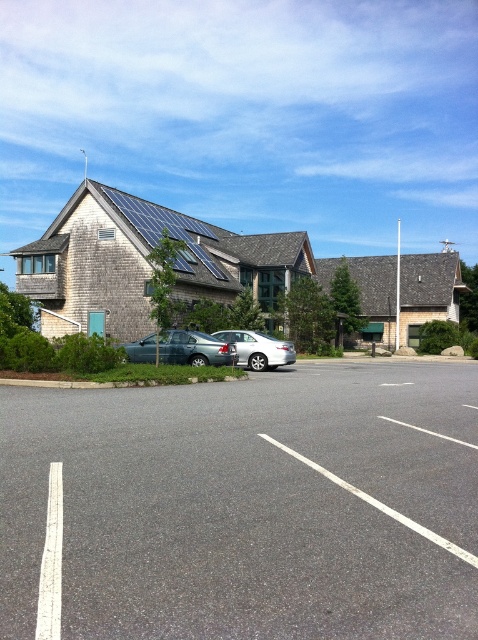
Question: Can you confirm if gray asphalt parking lot at center is thinner than white painted line at lower left?

Choices:
 (A) yes
 (B) no

Answer: (B)

Question: Does gray asphalt parking lot at center appear on the left side of silver metallic sedan at center?

Choices:
 (A) no
 (B) yes

Answer: (B)

Question: Which point appears closest to the camera in this image?

Choices:
 (A) click(56, 592)
 (B) click(197, 346)

Answer: (A)

Question: Can you confirm if gray asphalt parking lot at center is smaller than satin silver sedan at center?

Choices:
 (A) no
 (B) yes

Answer: (A)

Question: Which of these objects is positioned closest to the satin silver sedan at center?

Choices:
 (A) silver metallic sedan at center
 (B) white painted line at lower left

Answer: (A)

Question: Which is nearer to the silver metallic sedan at center?

Choices:
 (A) gray asphalt parking lot at center
 (B) satin silver sedan at center
 (C) white painted line at lower left

Answer: (B)